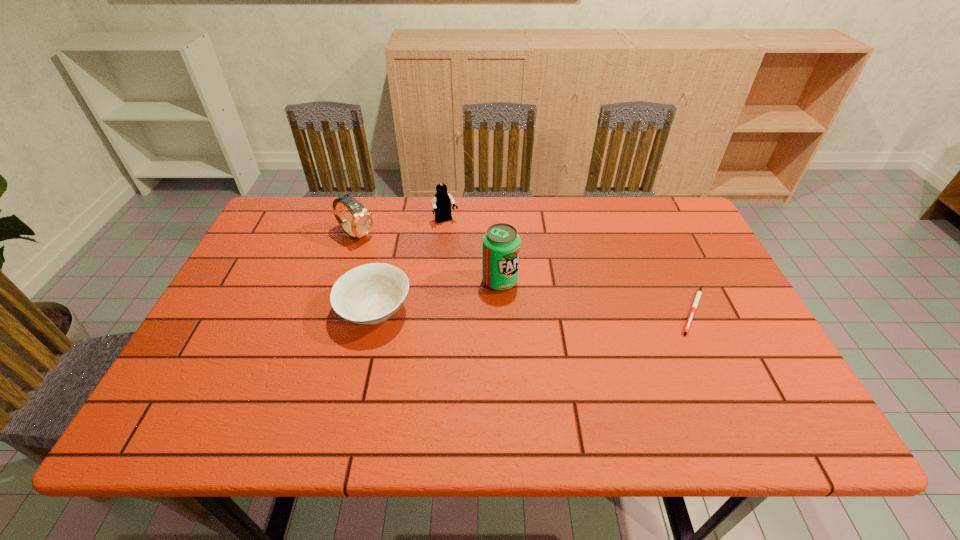
What are the coordinates of `object that is at the right edge` in the screenshot? It's located at (699, 292).

You are a GUI agent. You are given a task and a screenshot of the screen. Output one action in this format:
    pyautogui.click(x=<x>, y=<y>)
    Task: Click on the vacant area at the far edge of the desktop
    The width and height of the screenshot is (960, 540).
    Given the screenshot: What is the action you would take?
    pyautogui.click(x=383, y=242)

Find the location of a particular element. The width and height of the screenshot is (960, 540). free space at the near edge of the desktop is located at coordinates (587, 375).

Where is `vacant space at the left edge`? vacant space at the left edge is located at coordinates (238, 343).

In the image, there is a desktop. Identify the location of free space at the right edge. (702, 250).

The image size is (960, 540). What are the coordinates of `vacant space at the far left corner` in the screenshot? It's located at (307, 201).

Identify the location of blank space at the near left corner of the desktop. (197, 370).

You are a GUI agent. You are given a task and a screenshot of the screen. Output one action in this format:
    pyautogui.click(x=<x>, y=<y>)
    Task: Click on the vacant region at the far right corner
    This screenshot has width=960, height=540.
    Given the screenshot: What is the action you would take?
    pyautogui.click(x=640, y=199)

Find the location of `empty space that is in between the tallest object and the pen`. empty space that is in between the tallest object and the pen is located at coordinates (596, 296).

The width and height of the screenshot is (960, 540). In order to click on vacant area between the pop soda and the shortest object in this screenshot , I will do `click(596, 296)`.